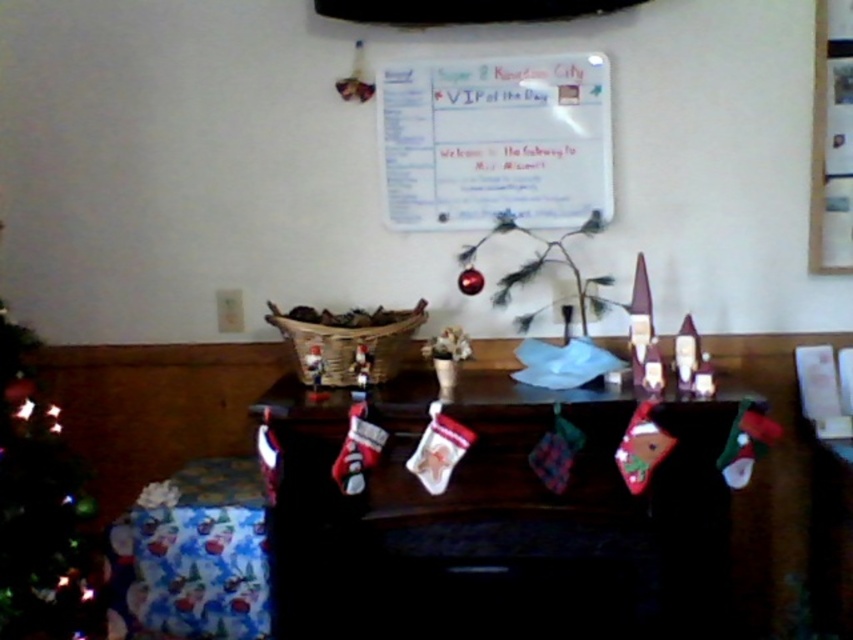
Between white paper at upper center and wrapping paper gift at lower left, which one is positioned lower?

wrapping paper gift at lower left is below.

Does point (579, 204) come behind point (131, 506)?

No, it is in front of (131, 506).

Where is `white paper at upper center`? The width and height of the screenshot is (853, 640). white paper at upper center is located at coordinates click(x=495, y=141).

The image size is (853, 640). What are the coordinates of `white paper at upper center` in the screenshot? It's located at (495, 141).

Can you confirm if velvet red stockings at center is thinner than wrapping paper gift at lower left?

In fact, velvet red stockings at center might be wider than wrapping paper gift at lower left.

Can you confirm if velvet red stockings at center is positioned to the left of wrapping paper gift at lower left?

No, velvet red stockings at center is not to the left of wrapping paper gift at lower left.

This screenshot has width=853, height=640. Describe the element at coordinates (498, 522) in the screenshot. I see `velvet red stockings at center` at that location.

Locate an element on the screen. The image size is (853, 640). velvet red stockings at center is located at coordinates (498, 522).

Consider the image. Does velvet red stockings at center have a smaller size compared to wooden picture frame at upper right?

Actually, velvet red stockings at center might be larger than wooden picture frame at upper right.

The height and width of the screenshot is (640, 853). What do you see at coordinates (498, 522) in the screenshot?
I see `velvet red stockings at center` at bounding box center [498, 522].

Describe the element at coordinates (498, 522) in the screenshot. The height and width of the screenshot is (640, 853). I see `velvet red stockings at center` at that location.

Locate an element on the screen. This screenshot has height=640, width=853. velvet red stockings at center is located at coordinates (498, 522).